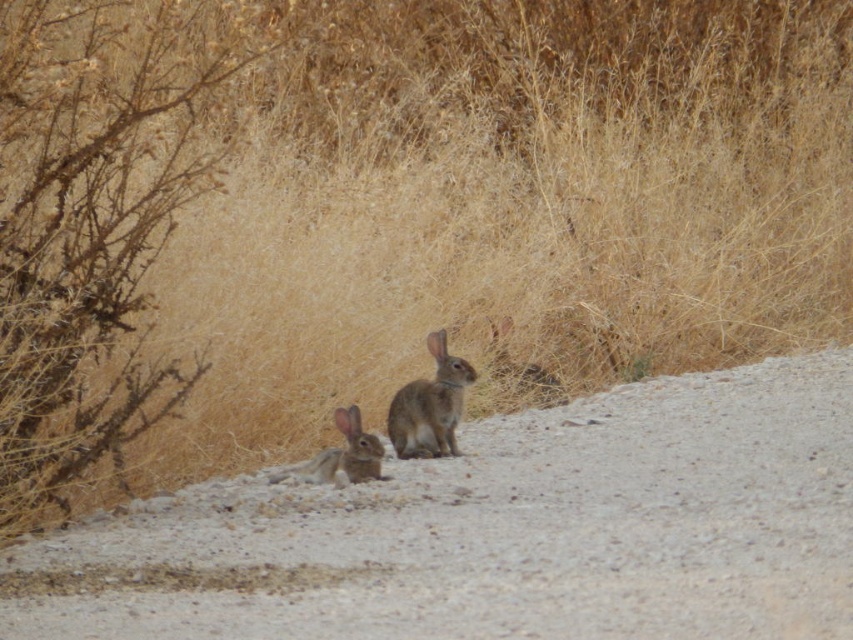
Question: Can you confirm if gray gravel road at center is positioned below brown dry bush at left?

Choices:
 (A) yes
 (B) no

Answer: (A)

Question: Considering the real-world distances, which object is farthest from the gray gravel road at center?

Choices:
 (A) brown dry bush at left
 (B) fuzzy brown rabbit at center
 (C) furry brown rabbit at center

Answer: (B)

Question: Which of the following is the closest to the observer?

Choices:
 (A) furry brown rabbit at center
 (B) brown dry bush at left
 (C) fuzzy brown rabbit at center

Answer: (B)

Question: Can you confirm if gray gravel road at center is positioned to the left of fuzzy brown rabbit at center?

Choices:
 (A) yes
 (B) no

Answer: (A)

Question: Which point appears farthest from the camera in this image?

Choices:
 (A) (442, 360)
 (B) (293, 468)
 (C) (521, 476)
 (D) (187, 170)

Answer: (A)

Question: Considering the relative positions of fuzzy brown rabbit at center and furry brown rabbit at center in the image provided, where is fuzzy brown rabbit at center located with respect to furry brown rabbit at center?

Choices:
 (A) above
 (B) below

Answer: (A)